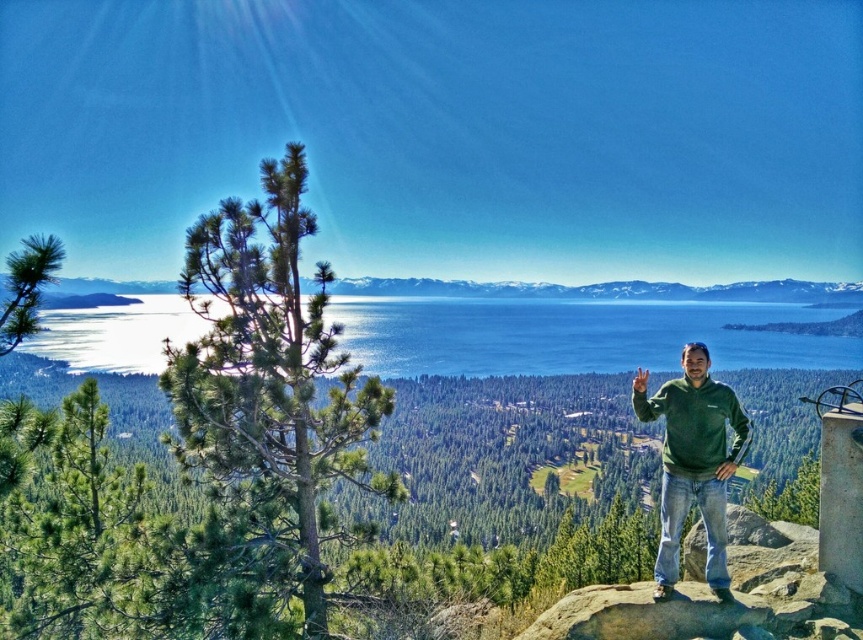
Based on the photo, can you confirm if green fleece at right is wider than snowy mountain at center?

No.

Is point (710, 552) in front of point (550, 291)?

Yes, it is.

The width and height of the screenshot is (863, 640). Describe the element at coordinates (693, 461) in the screenshot. I see `green fleece at right` at that location.

Image resolution: width=863 pixels, height=640 pixels. I want to click on green fleece at right, so click(693, 461).

In the scene shown: Is blue water at center to the left of green fleece at right from the viewer's perspective?

Indeed, blue water at center is positioned on the left side of green fleece at right.

At what (x,y) coordinates should I click in order to perform the action: click on blue water at center. Please return your answer as a coordinate pair (x, y). Image resolution: width=863 pixels, height=640 pixels. Looking at the image, I should click on (574, 336).

Who is positioned more to the left, blue water at center or snowy mountain at center?

From the viewer's perspective, blue water at center appears more on the left side.

Does blue water at center have a lesser height compared to snowy mountain at center?

No.

Does point (386, 316) come behind point (99, 291)?

No, it is not.

Locate an element on the screen. blue water at center is located at coordinates (574, 336).